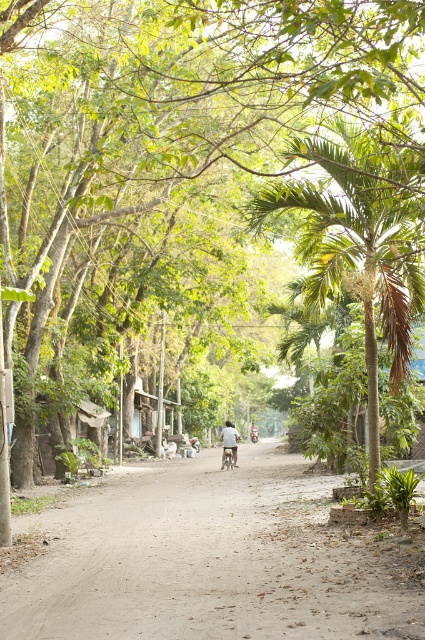
You are a delivery person standing at the starting point of the dirt road. You need to deliver a package to a client located at the end of the road. You see a light blue fabric shirt at center and a metallic silver bicycle at center. Which object should you focus on to determine the direction to proceed along the road?

You should focus on the metallic silver bicycle at center because it is positioned to the right of the light blue fabric shirt at center, indicating the direction of the road leading towards the destination.

You are standing on the dirt road and see the green leafy palm tree at center and the metallic silver bicycle at center. Which object is closer to you?

The green leafy palm tree at center is closer to the viewer than the metallic silver bicycle at center.